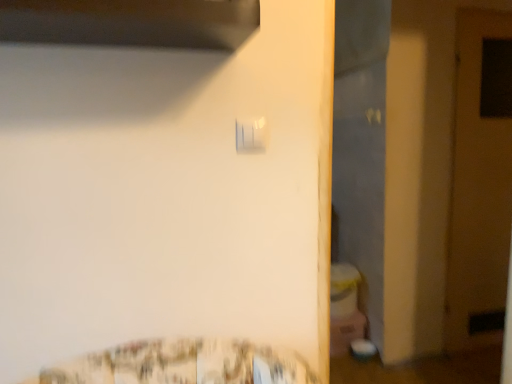
Question: Is white plastic light switch at upper center next to wooden door at right and touching it?

Choices:
 (A) no
 (B) yes

Answer: (A)

Question: Considering the relative sizes of white plastic light switch at upper center and wooden door at right in the image provided, is white plastic light switch at upper center taller than wooden door at right?

Choices:
 (A) no
 (B) yes

Answer: (A)

Question: Can you confirm if white plastic light switch at upper center is thinner than wooden door at right?

Choices:
 (A) no
 (B) yes

Answer: (B)

Question: Considering the relative sizes of white plastic light switch at upper center and wooden door at right in the image provided, is white plastic light switch at upper center smaller than wooden door at right?

Choices:
 (A) yes
 (B) no

Answer: (A)

Question: Is white plastic light switch at upper center at the left side of wooden door at right?

Choices:
 (A) no
 (B) yes

Answer: (B)

Question: Is white plastic light switch at upper center outside of wooden door at right?

Choices:
 (A) no
 (B) yes

Answer: (B)

Question: Is the depth of wooden door at right greater than that of white plastic light switch at upper center?

Choices:
 (A) no
 (B) yes

Answer: (B)

Question: From a real-world perspective, is wooden door at right over white plastic light switch at upper center?

Choices:
 (A) no
 (B) yes

Answer: (A)

Question: Is wooden door at right oriented away from white plastic light switch at upper center?

Choices:
 (A) no
 (B) yes

Answer: (A)

Question: Is wooden door at right next to white plastic light switch at upper center and touching it?

Choices:
 (A) no
 (B) yes

Answer: (A)

Question: Is wooden door at right aimed at white plastic light switch at upper center?

Choices:
 (A) yes
 (B) no

Answer: (B)

Question: Can you confirm if wooden door at right is smaller than white plastic light switch at upper center?

Choices:
 (A) no
 (B) yes

Answer: (A)

Question: In terms of size, does wooden door at right appear bigger or smaller than white plastic light switch at upper center?

Choices:
 (A) small
 (B) big

Answer: (B)